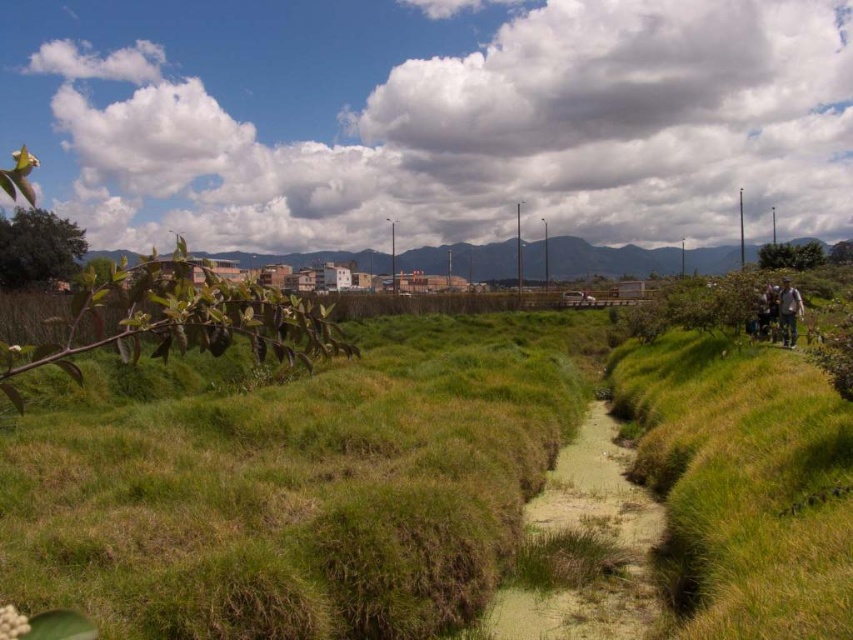
Question: Can you confirm if green grassy hill at center is thinner than camouflage fabric jacket at right?

Choices:
 (A) yes
 (B) no

Answer: (B)

Question: Which point is closer to the camera?

Choices:
 (A) (782, 340)
 (B) (221, 256)

Answer: (A)

Question: Can you confirm if green grassy hill at center is positioned below camouflage fabric jacket at right?

Choices:
 (A) yes
 (B) no

Answer: (B)

Question: Observing the image, what is the correct spatial positioning of green grassy hill at center in reference to camouflage fabric jacket at right?

Choices:
 (A) right
 (B) left

Answer: (B)

Question: Among these points, which one is farthest from the camera?

Choices:
 (A) (408, 262)
 (B) (793, 298)

Answer: (A)

Question: Among these points, which one is farthest from the camera?

Choices:
 (A) (779, 307)
 (B) (633, 262)

Answer: (B)